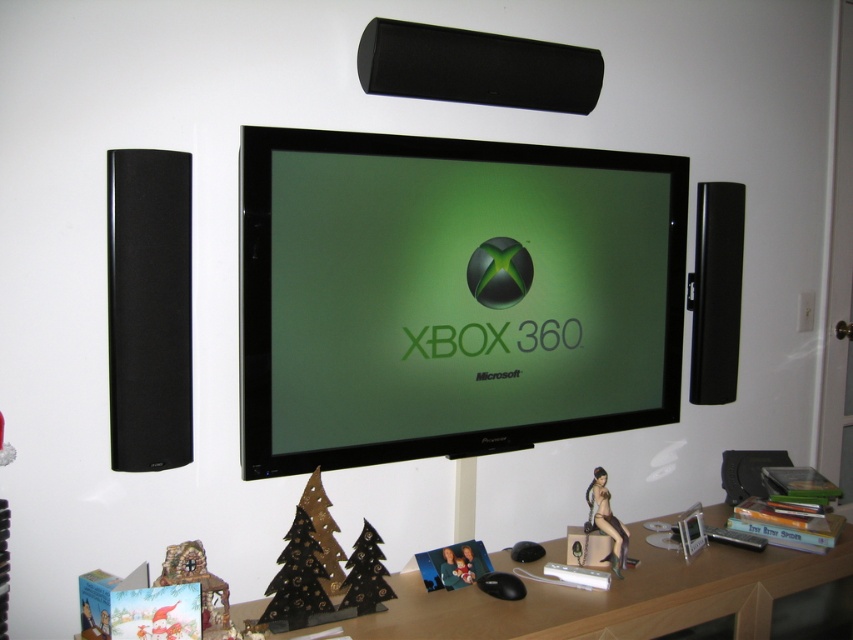
You are standing in front of the entertainment setup and want to place a small figurine on the wooden shelf. You have two options for placement at coordinates point (393,449) and point (593,481). Which coordinate position will make the figurine appear closer to you?

The figurine placed at point (393,449) will appear closer to you since it is closer to the viewer compared to the other point.

You are setting up a new entertainment system and have a matte black monitor at center and a wooden at lower center. Which object is taller?

The matte black monitor at center is much taller than the wooden at lower center.